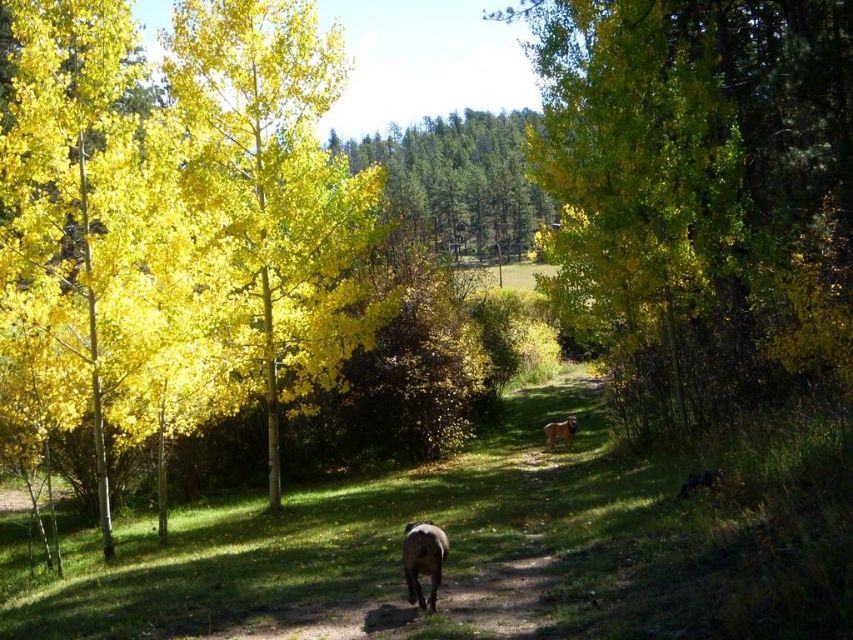
Image resolution: width=853 pixels, height=640 pixels. What do you see at coordinates (422, 561) in the screenshot? I see `brown furry dog at lower center` at bounding box center [422, 561].

Between brown furry dog at lower center and brown furry dog at center, which one has more height?

brown furry dog at lower center

At what (x,y) coordinates should I click in order to perform the action: click on brown furry dog at lower center. Please return your answer as a coordinate pair (x, y). The image size is (853, 640). Looking at the image, I should click on (422, 561).

This screenshot has height=640, width=853. Find the location of `brown furry dog at lower center`. brown furry dog at lower center is located at coordinates (422, 561).

Can you confirm if yellow leafy tree at center is smaller than brown furry dog at lower center?

Actually, yellow leafy tree at center might be larger than brown furry dog at lower center.

Can you confirm if yellow leafy tree at center is positioned to the right of brown furry dog at lower center?

Correct, you'll find yellow leafy tree at center to the right of brown furry dog at lower center.

Is point (691, 426) closer to viewer compared to point (445, 547)?

No, it is not.

Locate an element on the screen. The width and height of the screenshot is (853, 640). yellow leafy tree at center is located at coordinates (698, 195).

Who is lower down, yellow leafy tree at center or brown furry dog at center?

→ brown furry dog at center is lower down.

The width and height of the screenshot is (853, 640). What do you see at coordinates (698, 195) in the screenshot?
I see `yellow leafy tree at center` at bounding box center [698, 195].

What are the coordinates of `yellow leafy tree at center` in the screenshot? It's located at (698, 195).